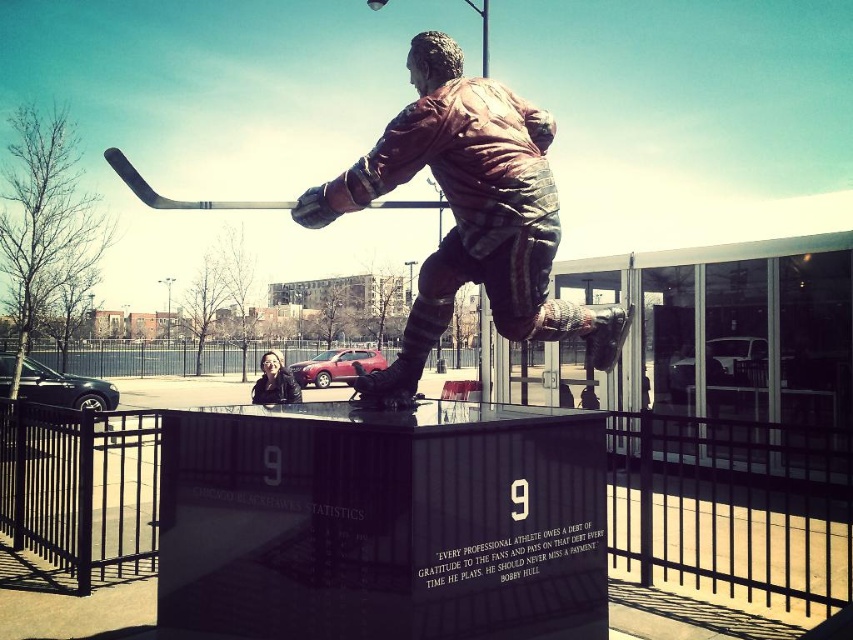
You are a photographer planning to take a portrait of the shiny bronze statue at center and the matte black jacket at center. Since you want to ensure both are visible in the frame, which object should you focus on first to avoid missing either?

The shiny bronze statue at center is not as tall as the matte black jacket at center, so you should focus on the taller matte black jacket at center first to ensure both are in frame.